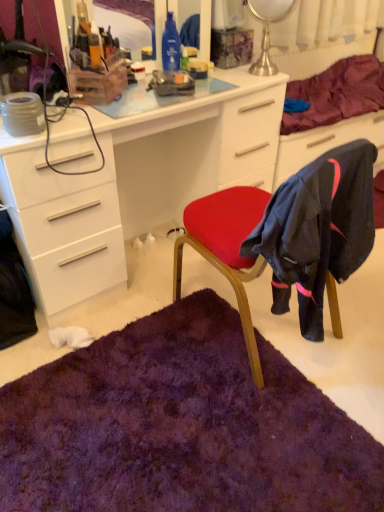
You are a GUI agent. You are given a task and a screenshot of the screen. Output one action in this format:
    pyautogui.click(x=<x>, y=<y>)
    Task: Click on the vacant area situated to the left side of metallic silver table lamp at upper center
    Image resolution: width=384 pixels, height=512 pixels.
    Given the screenshot: What is the action you would take?
    (x=231, y=78)